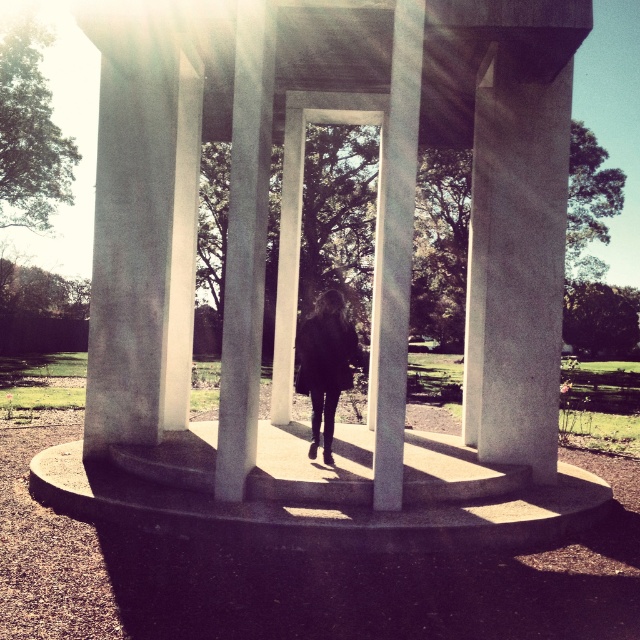
You are standing at the entrance of the white concrete gazebo at center and the smooth concrete pillar at center. Which object is closer to your right side?

The smooth concrete pillar at center is to the right of the white concrete gazebo at center, so the smooth concrete pillar at center is closer to your right side.

You are planning to place a large statue in the center of the white concrete gazebo at center. The statue requires a base that must be smaller than the smooth concrete pillar at center. Will the statue fit within the gazebo?

The white concrete gazebo at center is bigger than the smooth concrete pillar at center. Since the statue requires a base smaller than the pillar, the statue will fit within the gazebo as the gazebo is larger than the pillar.